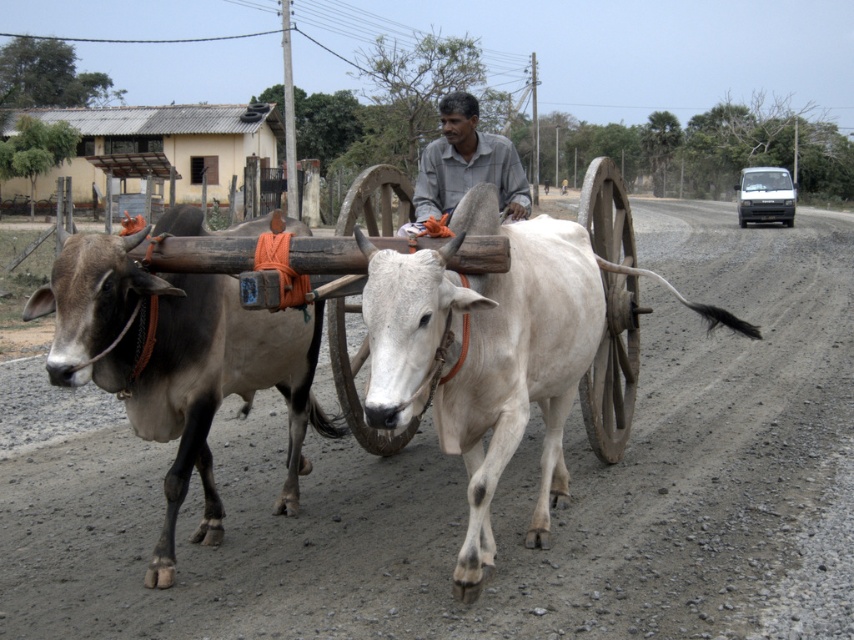
Question: Which of the following is the farthest from the observer?

Choices:
 (A) gray gravel road at center
 (B) brown leather bull at center

Answer: (A)

Question: Among these objects, which one is farthest from the camera?

Choices:
 (A) brown leather bull at center
 (B) wooden cart at center

Answer: (A)

Question: Observing the image, what is the correct spatial positioning of brown leather bull at center in reference to wooden cart at center?

Choices:
 (A) left
 (B) right

Answer: (A)

Question: Is wooden cart at center smaller than light gray shirt at center?

Choices:
 (A) no
 (B) yes

Answer: (A)

Question: Which is nearer to the light gray shirt at center?

Choices:
 (A) wooden cart at center
 (B) brown leather bull at center
 (C) gray gravel road at center

Answer: (A)

Question: Can you confirm if gray gravel road at center is thinner than wooden cart at center?

Choices:
 (A) no
 (B) yes

Answer: (A)